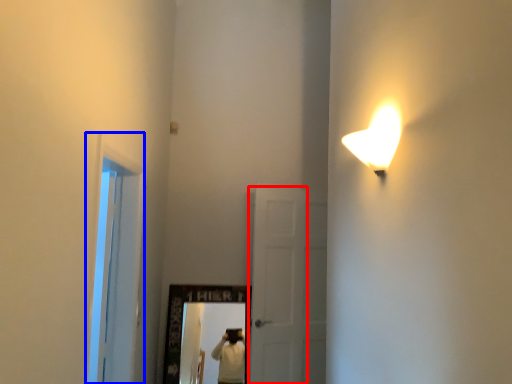
Question: Which object appears closest to the camera in this image, door (highlighted by a red box) or window (highlighted by a blue box)?

Choices:
 (A) door
 (B) window

Answer: (B)